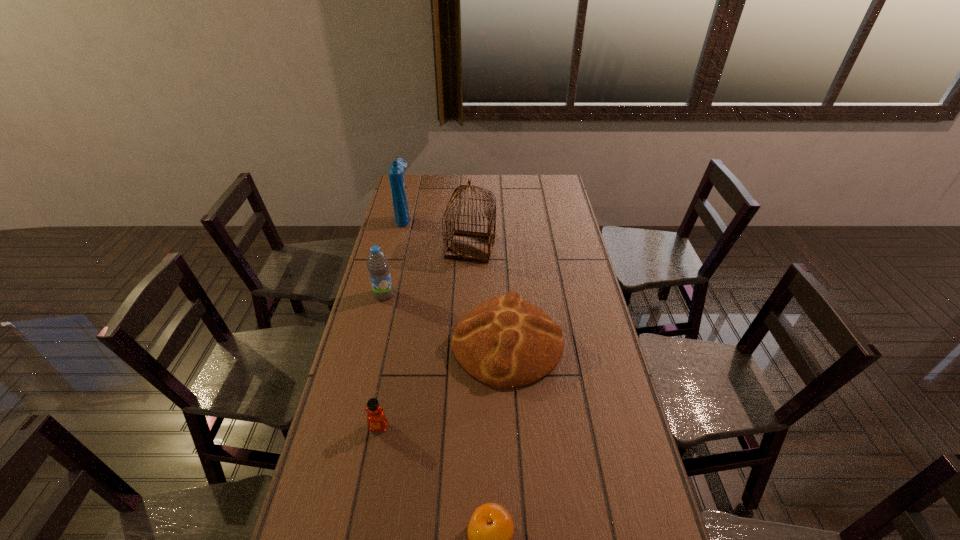
Where is `vacant area at the far left corner of the desktop`? vacant area at the far left corner of the desktop is located at coordinates (426, 181).

Identify the location of unoccupied position between the third nearest object and the water bottle. tap(445, 319).

Where is `free spot between the fourth tallest object and the honey`? The height and width of the screenshot is (540, 960). free spot between the fourth tallest object and the honey is located at coordinates (443, 384).

Image resolution: width=960 pixels, height=540 pixels. I want to click on free space between the fourth tallest object and the shampoo, so click(x=455, y=280).

Locate an element on the screen. free space between the farthest object and the third farthest object is located at coordinates (394, 256).

Find the location of a particular element. This screenshot has width=960, height=540. vacant area between the shampoo and the fourth shortest object is located at coordinates (394, 256).

The image size is (960, 540). Identify the location of vacant space in between the water bottle and the fifth tallest object. (381, 361).

The height and width of the screenshot is (540, 960). In order to click on vacant point located between the farthest object and the second nearest object in this screenshot , I will do `click(392, 322)`.

Where is `vacant space that's between the second farthest object and the fourth nearest object`? vacant space that's between the second farthest object and the fourth nearest object is located at coordinates (427, 271).

Locate an element on the screen. The height and width of the screenshot is (540, 960). free point between the bread and the birdcage is located at coordinates (489, 295).